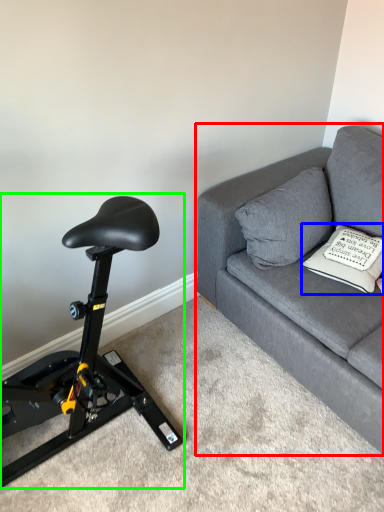
Question: Considering the real-world distances, which object is closest to studio couch (highlighted by a red box)? pillow (highlighted by a blue box) or stationary bicycle (highlighted by a green box).

Choices:
 (A) pillow
 (B) stationary bicycle

Answer: (A)